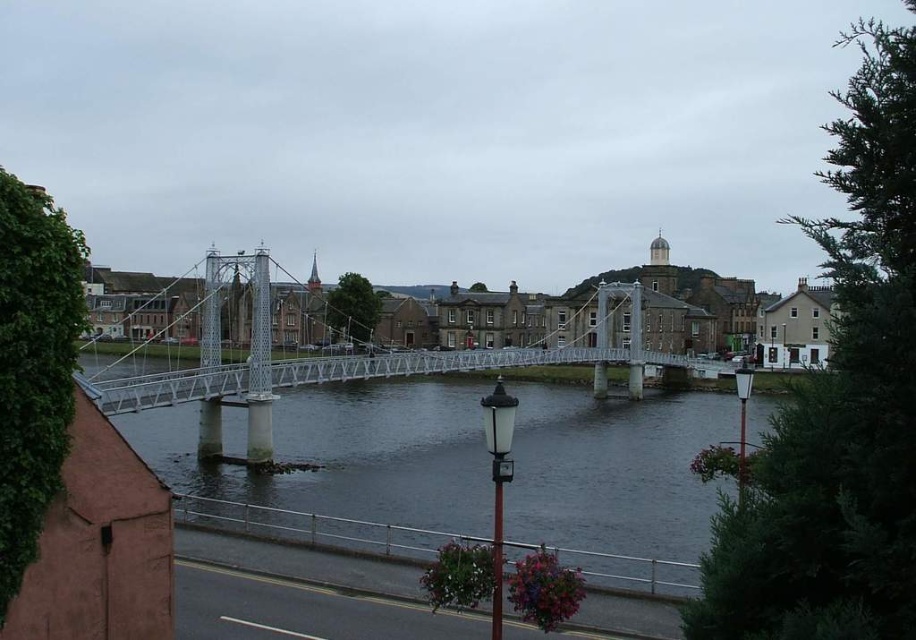
Who is positioned more to the right, clear water at center or white metal bridge at center?

white metal bridge at center

Between clear water at center and white metal bridge at center, which one is positioned higher?

white metal bridge at center

What do you see at coordinates (346, 465) in the screenshot? This screenshot has height=640, width=916. I see `clear water at center` at bounding box center [346, 465].

At what (x,y) coordinates should I click in order to perform the action: click on clear water at center. Please return your answer as a coordinate pair (x, y). Image resolution: width=916 pixels, height=640 pixels. Looking at the image, I should click on (346, 465).

This screenshot has width=916, height=640. Find the location of `white metallic suspension bridge at center`. white metallic suspension bridge at center is located at coordinates (351, 365).

Looking at this image, does white metallic suspension bridge at center have a greater height compared to white plastic lamp post at lower right?

Correct, white metallic suspension bridge at center is much taller as white plastic lamp post at lower right.

Which is in front, point (243, 401) or point (740, 372)?

Point (740, 372) is more forward.

Locate an element on the screen. white metallic suspension bridge at center is located at coordinates (351, 365).

Is clear water at center wider than white metallic suspension bridge at center?

Yes.

Is point (617, 576) behind point (251, 464)?

No, (617, 576) is closer to viewer.

This screenshot has height=640, width=916. Find the location of `clear water at center`. clear water at center is located at coordinates pos(346,465).

In order to click on clear water at center in this screenshot , I will do `click(346, 465)`.